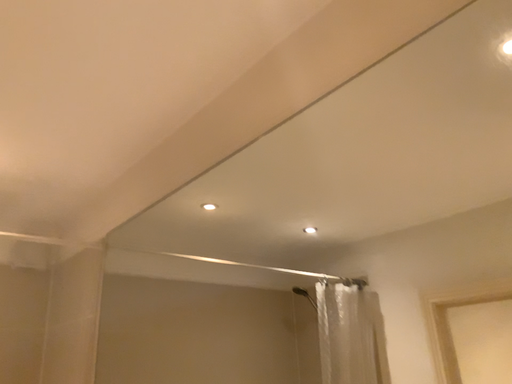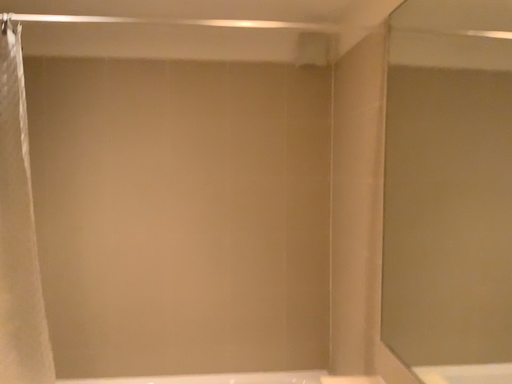
Question: How did the camera likely rotate when shooting the video?

Choices:
 (A) rotated downward
 (B) rotated upward

Answer: (A)